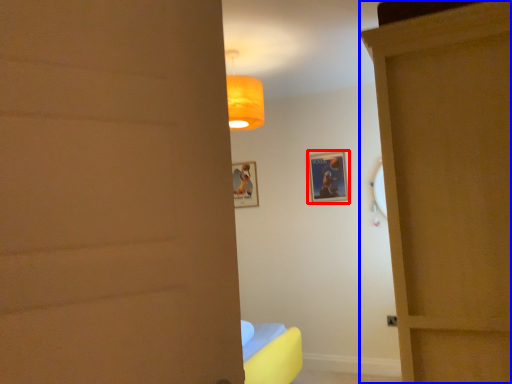
Question: Which object is further to the camera taking this photo, picture frame (highlighted by a red box) or door (highlighted by a blue box)?

Choices:
 (A) picture frame
 (B) door

Answer: (A)